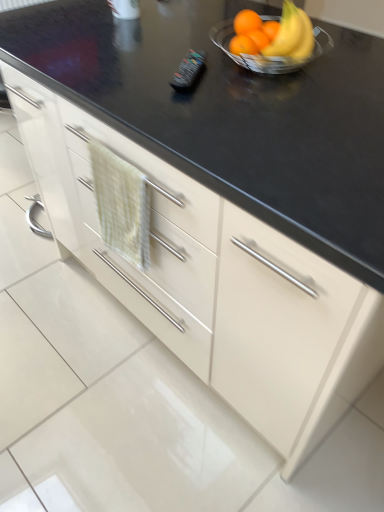
I want to click on vacant area that is situated to the right of black plastic remote control at center, so click(x=254, y=76).